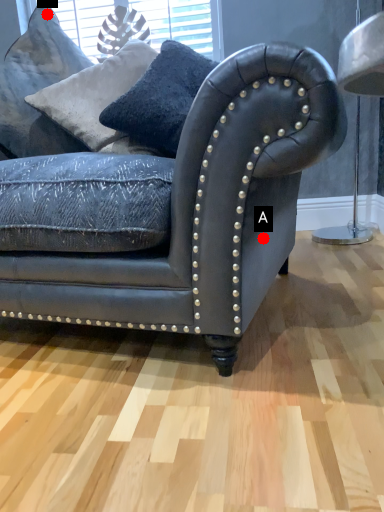
Question: Two points are circled on the image, labeled by A and B beside each circle. Which point is farther to the camera?

Choices:
 (A) A is further
 (B) B is further

Answer: (B)